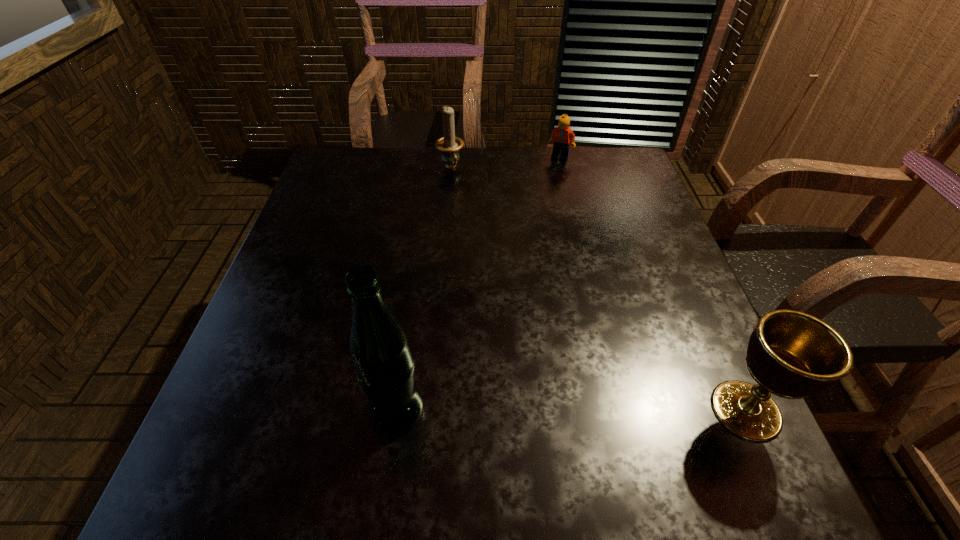
The width and height of the screenshot is (960, 540). Identify the location of free space between the shortest object and the rightmost object. (653, 284).

This screenshot has height=540, width=960. I want to click on vacant area between the candle_holder and the beer bottle, so click(x=424, y=289).

Identify the location of vacant area that lies between the beer bottle and the rightmost object. (571, 410).

You are a GUI agent. You are given a task and a screenshot of the screen. Output one action in this format:
    pyautogui.click(x=<x>, y=<y>)
    Task: Click on the unoccupied position between the candle_holder and the rightmost object
    
    Given the screenshot: What is the action you would take?
    pyautogui.click(x=598, y=289)

Find the location of `object that can be found as the second closest to the tallest object`. object that can be found as the second closest to the tallest object is located at coordinates (449, 145).

Identify the location of object that is the second closest one to the candle_holder. (384, 364).

The image size is (960, 540). Find the location of `vacant space that satisfies the following two spatial constraints: 1. on the back side of the candle_holder; 2. on the right side of the tallest object`. vacant space that satisfies the following two spatial constraints: 1. on the back side of the candle_holder; 2. on the right side of the tallest object is located at coordinates coord(431,168).

Where is `vacant position in the image that satisfies the following two spatial constraints: 1. on the back side of the tallest object; 2. on the left side of the Lego`? The width and height of the screenshot is (960, 540). vacant position in the image that satisfies the following two spatial constraints: 1. on the back side of the tallest object; 2. on the left side of the Lego is located at coordinates (433, 157).

Locate an element on the screen. This screenshot has width=960, height=540. free space that satisfies the following two spatial constraints: 1. on the back side of the chalice; 2. on the right side of the tallest object is located at coordinates (397, 410).